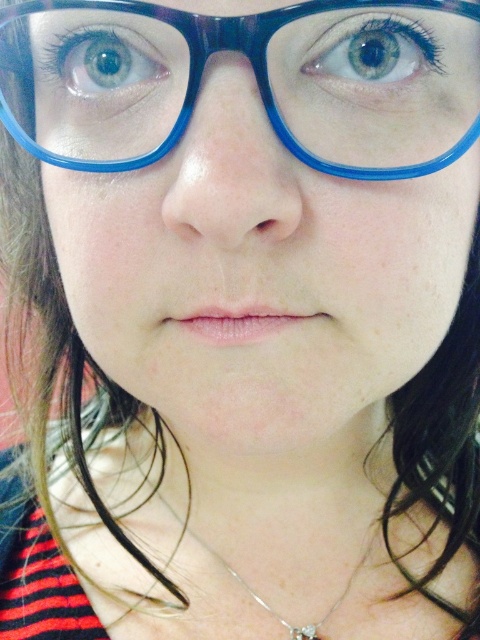
Question: Does blue glossy eye at upper left lie behind silver metallic necklace at center?

Choices:
 (A) yes
 (B) no

Answer: (B)

Question: Is blue glossy eye at upper center thinner than silver metallic necklace at center?

Choices:
 (A) no
 (B) yes

Answer: (B)

Question: Which point appears closest to the camera in this image?

Choices:
 (A) (97, 102)
 (B) (328, 609)
 (C) (336, 60)
 (D) (72, 115)

Answer: (C)

Question: Which of these objects is positioned farthest from the blue glossy eye at upper center?

Choices:
 (A) blue glossy eye at upper left
 (B) blue plastic glasses at upper center

Answer: (A)

Question: Which point is closer to the camera?

Choices:
 (A) (338, 602)
 (B) (354, 54)
 (C) (384, 26)

Answer: (C)

Question: Does blue plastic glasses at upper center appear under blue glossy eye at upper left?

Choices:
 (A) yes
 (B) no

Answer: (A)